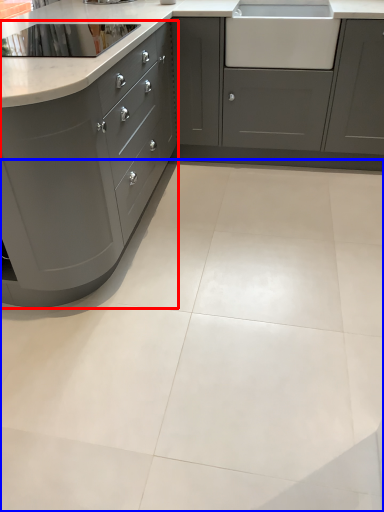
Question: Among these objects, which one is farthest to the camera, cabinetry (highlighted by a red box) or ceramic tile (highlighted by a blue box)?

Choices:
 (A) cabinetry
 (B) ceramic tile

Answer: (A)